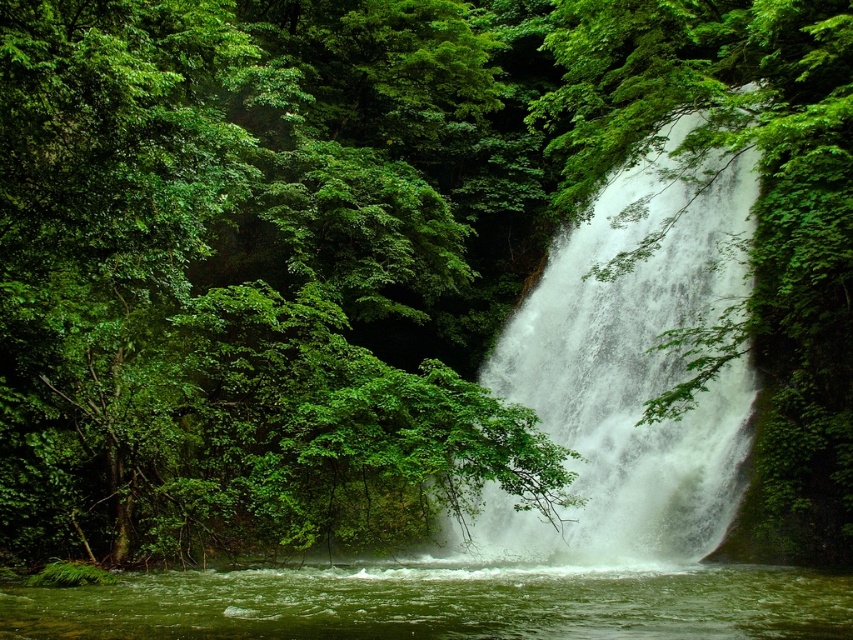
You are a hiker who wants to cross the river at the base of the waterfall. You see the white frothy water at center and the green liquid water at lower center. Which part of the water would be deeper? Explain your reasoning based on the scene description.

The green liquid water at lower center is deeper than the white frothy water at center. Since the white frothy water at center is much taller, it indicates that the water is flowing rapidly and creating foam, which typically occurs in shallower areas with more turbulence. In contrast, the green liquid water at lower center, being shorter, likely has a calmer flow and deeper depth, allowing for clearer visibility of the water color.

You are standing at the edge of the forest looking at the waterfall. There is a point marked at coordinates (630, 371). What is located at this point?

The point at coordinates (630, 371) indicates the white frothy water at center.

Looking at this image, you are standing in the forest and see the white frothy water at center. If you want to locate it precisely, what are its coordinates?

The white frothy water at center is located at coordinates point (630,371).